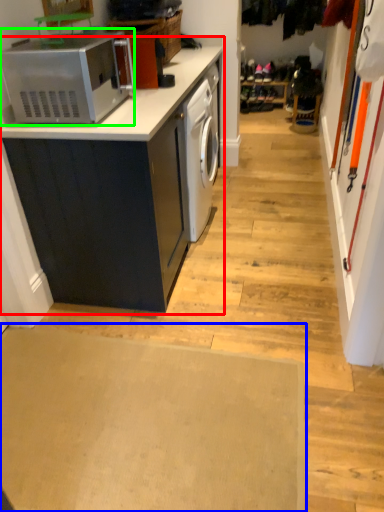
Question: Which object is positioned closest to cabinetry (highlighted by a red box)? Select from plain (highlighted by a blue box) and home appliance (highlighted by a green box).

Choices:
 (A) plain
 (B) home appliance

Answer: (B)